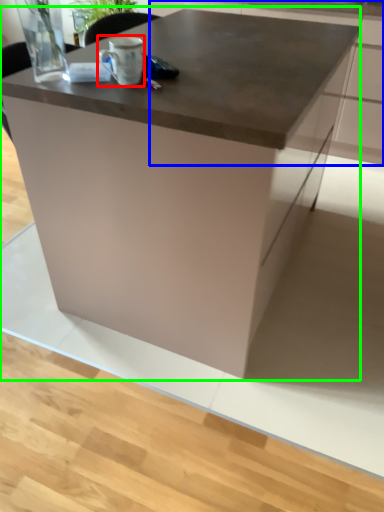
Question: Based on their relative distances, which object is farther from coffee cup (highlighted by a red box)? Choose from cabinetry (highlighted by a blue box) and table (highlighted by a green box).

Choices:
 (A) cabinetry
 (B) table

Answer: (A)